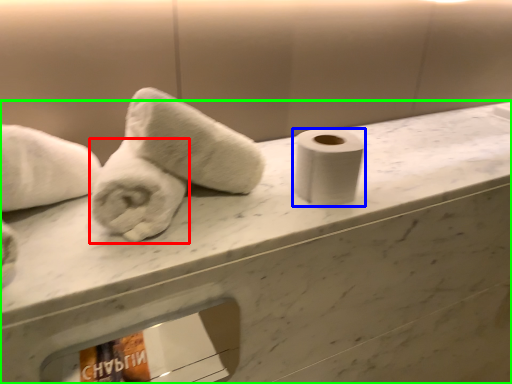
Question: Which object is positioned farthest from towel (highlighted by a red box)? Select from toilet paper (highlighted by a blue box) and counter (highlighted by a green box).

Choices:
 (A) toilet paper
 (B) counter

Answer: (B)